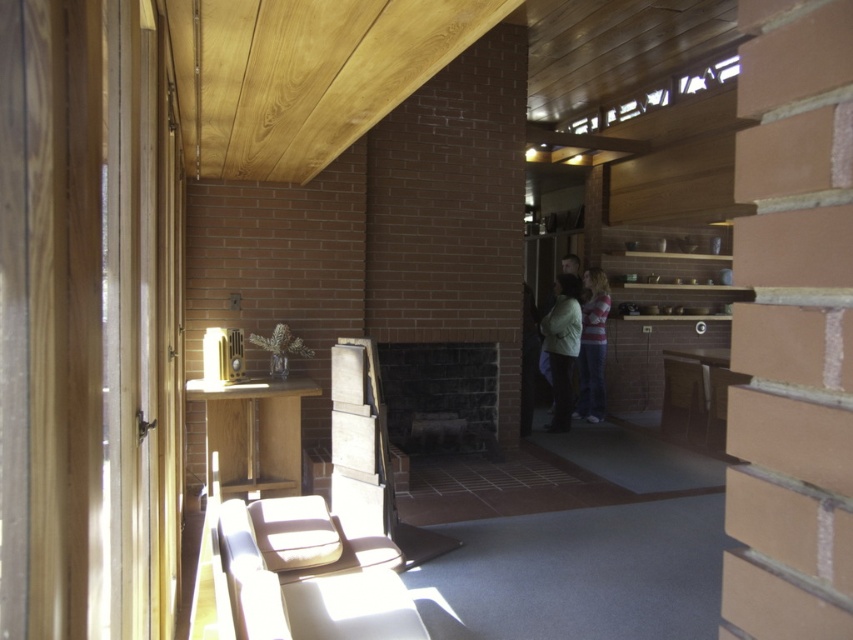
You are standing in the room and see both the light beige sweater at center and the striped cotton shirt at center. Which item is nearer to you?

The light beige sweater at center is closer to the viewer than the striped cotton shirt at center, so the light beige sweater at center is nearer to you.